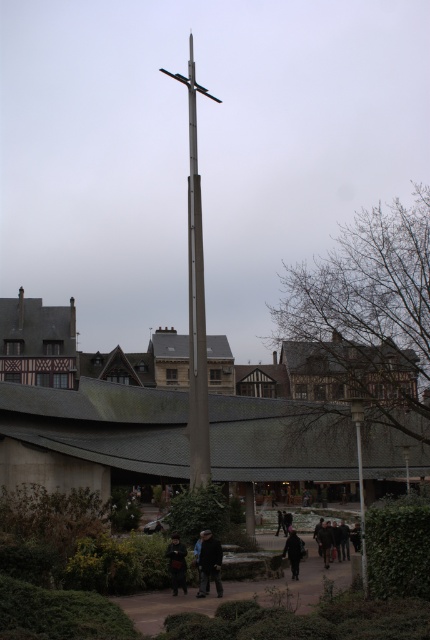
You are standing in the urban scene and see the dark blue jeans at lower center and the dark gray jacket at center. Which item is positioned higher up in the image?

The dark blue jeans at lower center is above the dark gray jacket at center, so the dark blue jeans at lower center is positioned higher up in the image.

You are a pedestrian standing at the edge of the square, looking towards the center. You see the metallic gray pole at center and the dark gray jacket at lower center. Which object is positioned higher from the ground?

The metallic gray pole at center is located above the dark gray jacket at lower center, so it is positioned higher from the ground.